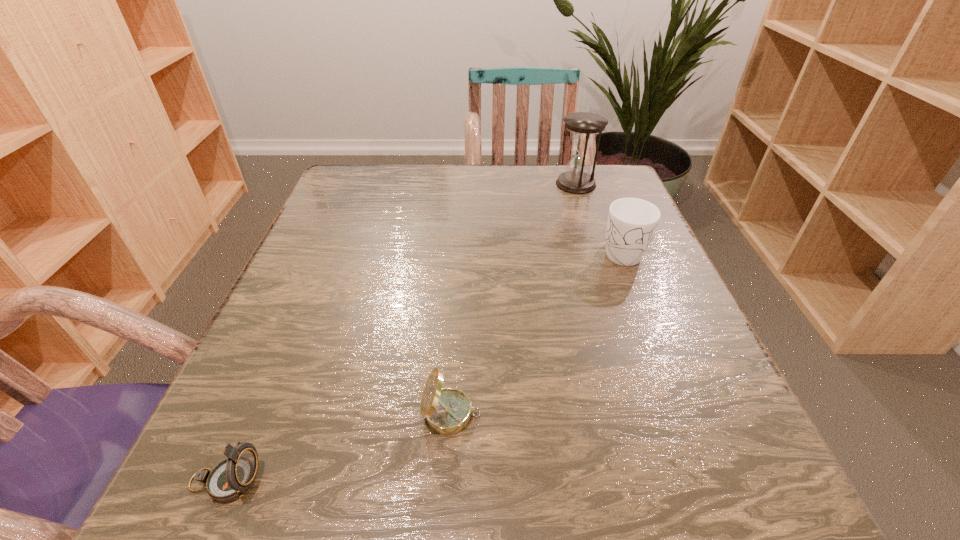
The height and width of the screenshot is (540, 960). Find the location of `free location that satisfies the following two spatial constraints: 1. on the side of the mug with the handle; 2. with the dial facing the right compass`. free location that satisfies the following two spatial constraints: 1. on the side of the mug with the handle; 2. with the dial facing the right compass is located at coordinates (685, 414).

Locate an element on the screen. The height and width of the screenshot is (540, 960). vacant space that satisfies the following two spatial constraints: 1. on the side of the mug with the handle; 2. on the face of the leftmost object is located at coordinates (711, 481).